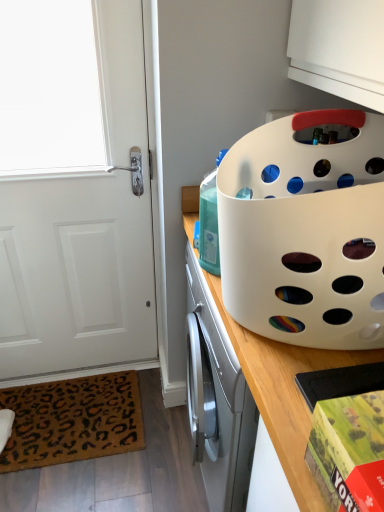
Image resolution: width=384 pixels, height=512 pixels. I want to click on vacant area on top of brown leopard print mat at lower left (from a real-world perspective), so click(x=72, y=415).